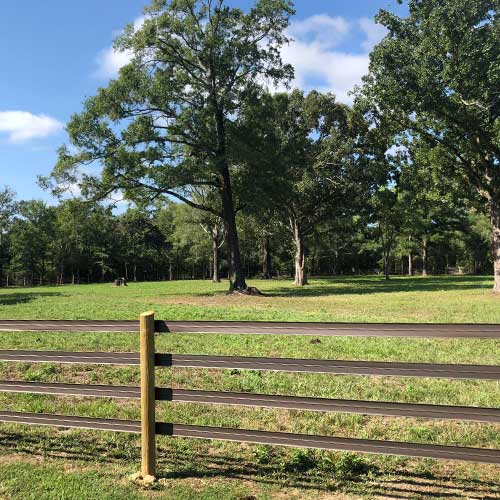
The image size is (500, 500). What are the coordinates of `top rail` in the screenshot? It's located at (73, 326), (331, 332).